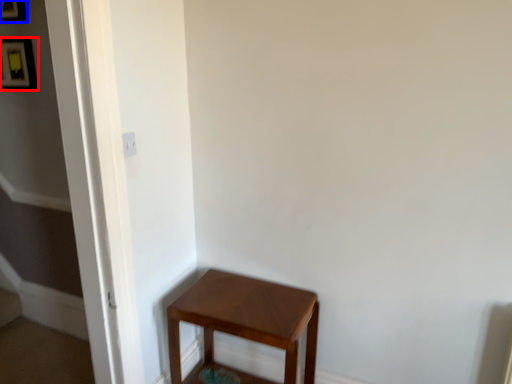
Question: Which point is closer to the camera, picture frame (highlighted by a red box) or picture frame (highlighted by a blue box)?

Choices:
 (A) picture frame
 (B) picture frame

Answer: (B)